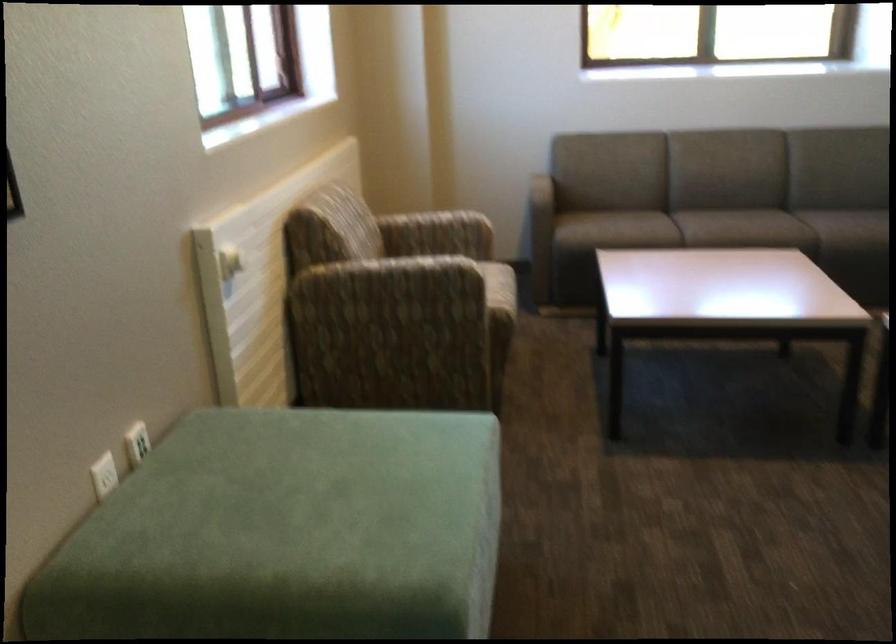
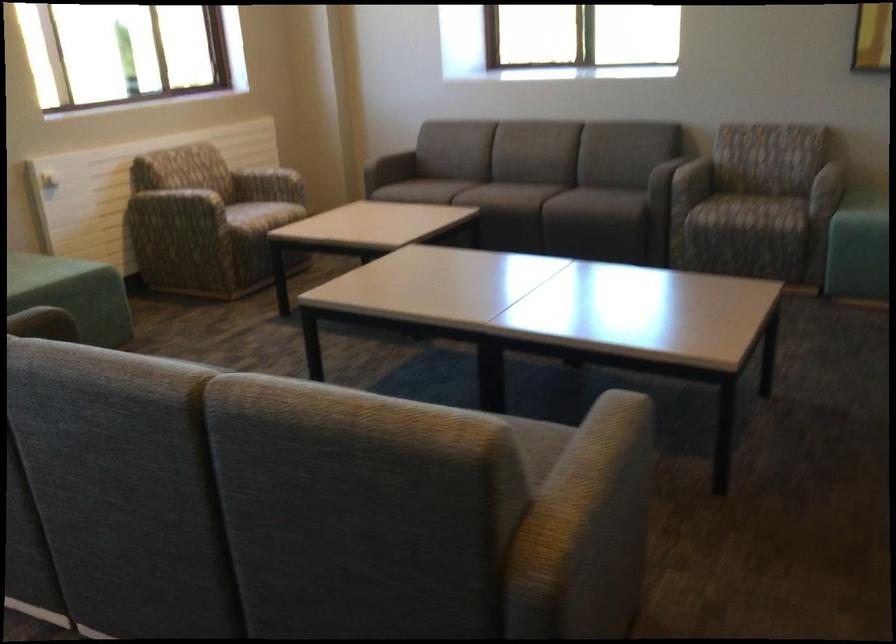
Find the pixel in the second image that matches point 648,223 in the first image.

(455, 187)